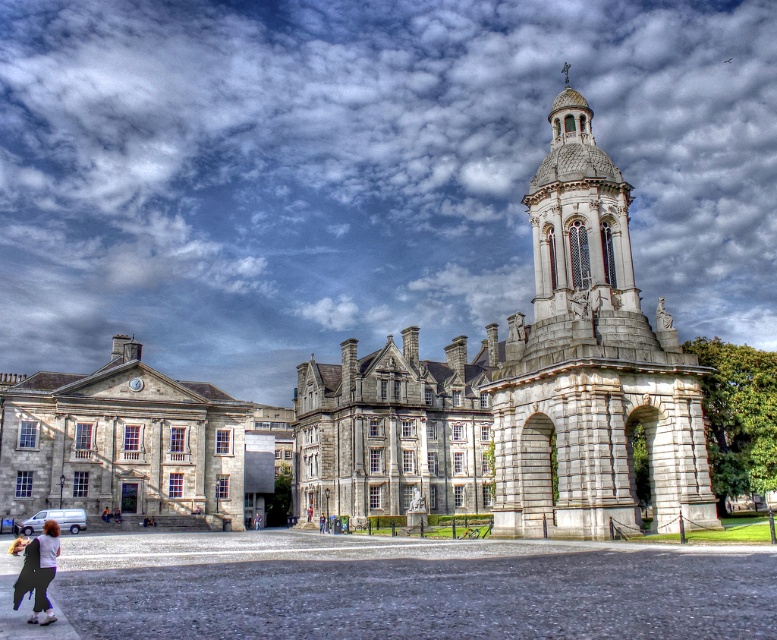
Who is higher up, white stone tower at center-right or matte white shirt at lower left?

white stone tower at center-right

The width and height of the screenshot is (777, 640). I want to click on white stone tower at center-right, so click(x=591, y=365).